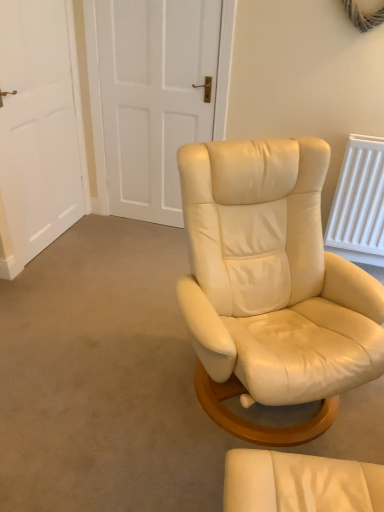
At what (x,y) coordinates should I click in order to perform the action: click on vacant area situated below white matte door at upper center, acting as the 2th door starting from the left (from a real-world perspective). Please return your answer as a coordinate pair (x, y). This screenshot has height=512, width=384. Looking at the image, I should click on click(147, 225).